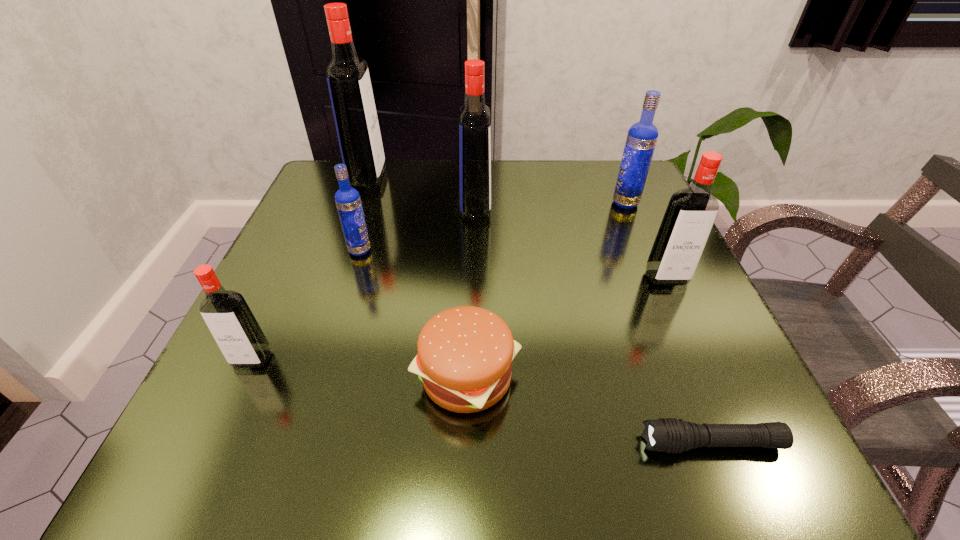
Find the location of a particular element. vacant area that lies between the seventh shortest object and the farthest red vodka is located at coordinates (421, 193).

The image size is (960, 540). What are the coordinates of `vacant area that lies between the seventh tallest object and the nearest object` in the screenshot? It's located at (589, 410).

Identify the location of empty space between the second red vodka from left to right and the hamburger. (418, 277).

Locate an element on the screen. blank region between the hamburger and the right blue vodka is located at coordinates (546, 290).

The width and height of the screenshot is (960, 540). What are the coordinates of `free space between the smaller blue vodka and the smallest red vodka` in the screenshot? It's located at (306, 305).

The image size is (960, 540). I want to click on free area in between the hamburger and the leftmost vodka, so click(359, 368).

Identify the location of vacant region between the leftmost vodka and the second red vodka from left to right. This screenshot has width=960, height=540. click(x=310, y=268).

This screenshot has height=540, width=960. What are the coordinates of `object that is the fourth closest to the second shortest object` in the screenshot? It's located at (691, 212).

Where is `object that is the fourth closest one to the second smallest red vodka`? This screenshot has width=960, height=540. object that is the fourth closest one to the second smallest red vodka is located at coordinates (474, 122).

Identify the location of vodka that is the third closest to the flashlight. Image resolution: width=960 pixels, height=540 pixels. (642, 136).